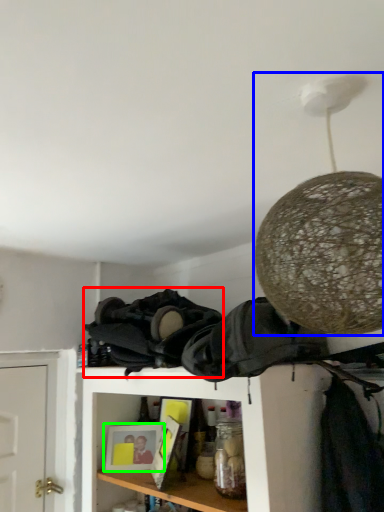
Question: Considering the real-world distances, which object is closest to clothing (highlighted by a red box)? lamp (highlighted by a blue box) or picture frame (highlighted by a green box).

Choices:
 (A) lamp
 (B) picture frame

Answer: (B)